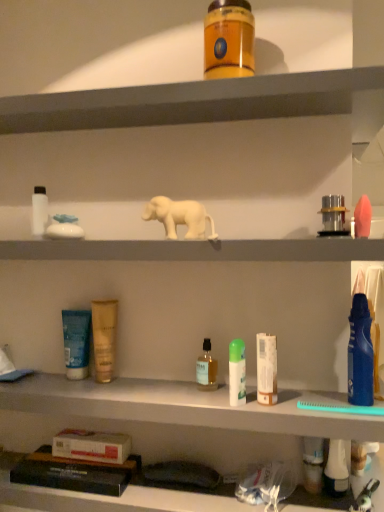
Question: Considering the positions of pink matte sponge at right, which is the twelfth toiletry in left-to-right order, and white matte tube at center, marked as the seventh toiletry in a left-to-right arrangement, in the image, is pink matte sponge at right, which is the twelfth toiletry in left-to-right order, wider or thinner than white matte tube at center, marked as the seventh toiletry in a left-to-right arrangement,?

Choices:
 (A) thin
 (B) wide

Answer: (B)

Question: In terms of size, does pink matte sponge at right, the first toiletry in the right-to-left sequence, appear bigger or smaller than white matte tube at center, marked as the seventh toiletry in a left-to-right arrangement?

Choices:
 (A) big
 (B) small

Answer: (A)

Question: Which object is positioned closest to the white matte tube at center, which is counted as the 6th toiletry, starting from the right?

Choices:
 (A) translucent glass bottle at center, the 9th toiletry from the right
 (B) white matte bottle at left, the first toiletry viewed from the left
 (C) white matte elephant at center
 (D) matte orange jar at upper center, which ranks as the eighth toiletry in right-to-left order
 (E) matte gold tube at center, placed as the third toiletry when sorted from left to right

Answer: (A)

Question: Considering the real-world distances, which object is closest to the translucent glass bottle at center, placed as the fourth toiletry when sorted from left to right?

Choices:
 (A) white matte bottle at left, marked as the 12th toiletry in a right-to-left arrangement
 (B) translucent plastic cup at lower right, arranged as the fifth toiletry when viewed from the right
 (C) pink matte sponge at right, the first toiletry in the right-to-left sequence
 (D) matte orange jar at upper center, marked as the fifth toiletry in a left-to-right arrangement
 (E) white matte elephant at center

Answer: (B)